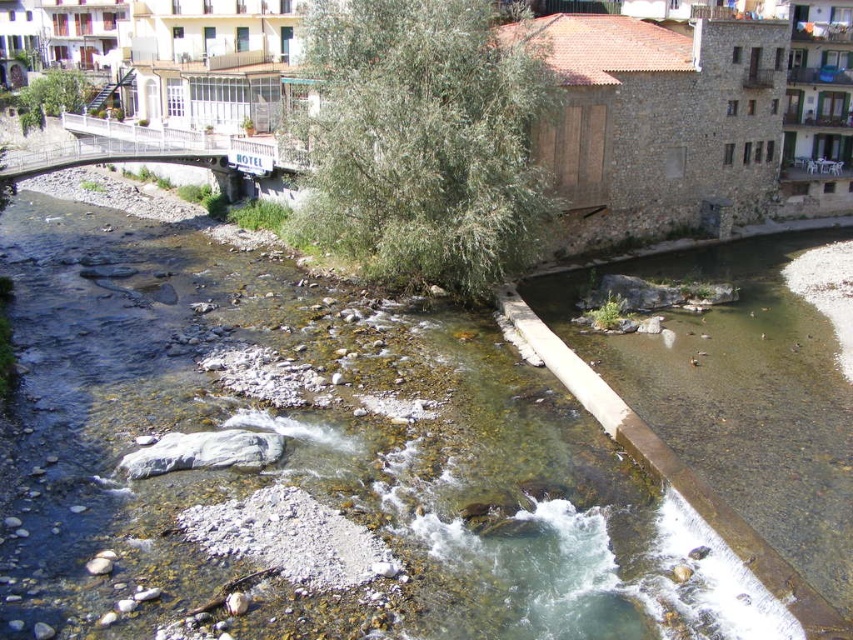
Question: In this image, where is clear water at center located relative to green leafy tree at center?

Choices:
 (A) below
 (B) above

Answer: (A)

Question: Considering the real-world distances, which object is farthest from the green leafy tree at center?

Choices:
 (A) clear water at center
 (B) white metal bridge at upper left

Answer: (B)

Question: Can you confirm if clear water at center is positioned above green leafy tree at center?

Choices:
 (A) no
 (B) yes

Answer: (A)

Question: Which object appears closest to the camera in this image?

Choices:
 (A) white metal bridge at upper left
 (B) clear water at center

Answer: (B)

Question: Among these points, which one is farthest from the camera?

Choices:
 (A) (59, 166)
 (B) (408, 163)
 (C) (566, 572)

Answer: (A)

Question: Can you confirm if clear water at center is bigger than white metal bridge at upper left?

Choices:
 (A) yes
 (B) no

Answer: (B)